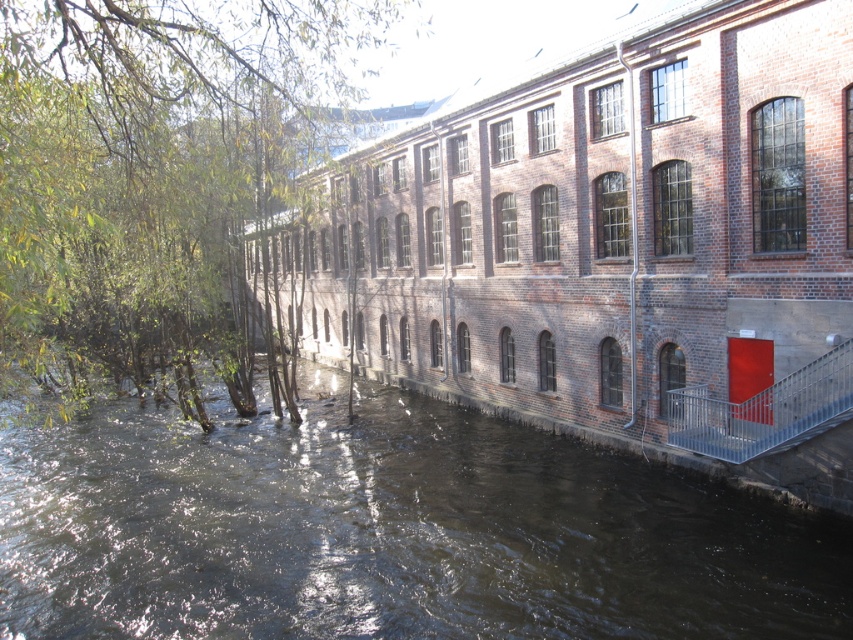
Question: Is the position of dark brown water at center more distant than that of metallic silver railing at lower right?

Choices:
 (A) no
 (B) yes

Answer: (A)

Question: Which point is closer to the camera?

Choices:
 (A) (39, 388)
 (B) (732, 426)
 (C) (473, 472)

Answer: (B)

Question: In this image, where is dark brown water at center located relative to metallic silver railing at lower right?

Choices:
 (A) right
 (B) left

Answer: (B)

Question: Which point is closer to the camera?

Choices:
 (A) (804, 436)
 (B) (137, 636)

Answer: (B)

Question: Is dark brown water at center bigger than green leafy tree at left?

Choices:
 (A) yes
 (B) no

Answer: (B)

Question: Which object is the farthest from the metallic silver railing at lower right?

Choices:
 (A) dark brown water at center
 (B) green leafy tree at left

Answer: (B)